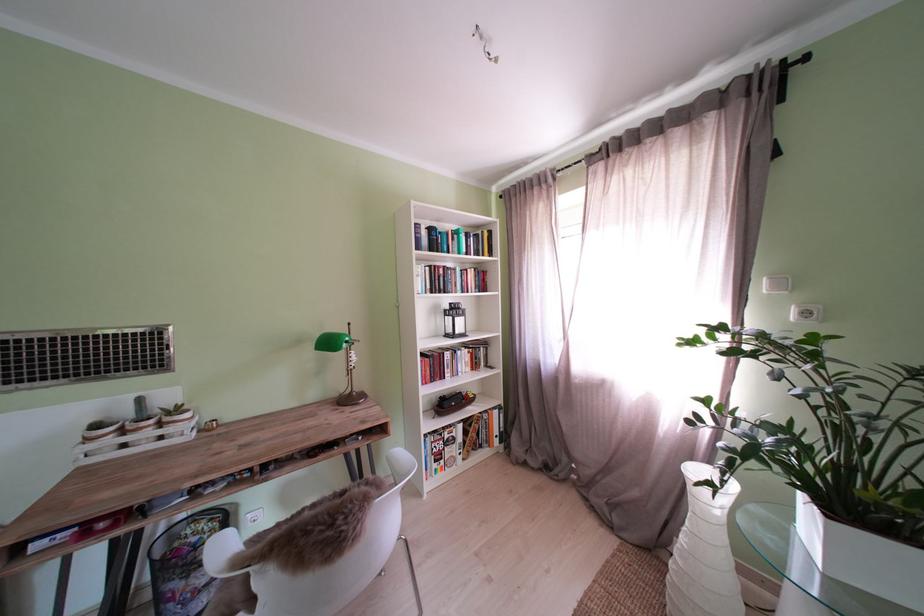
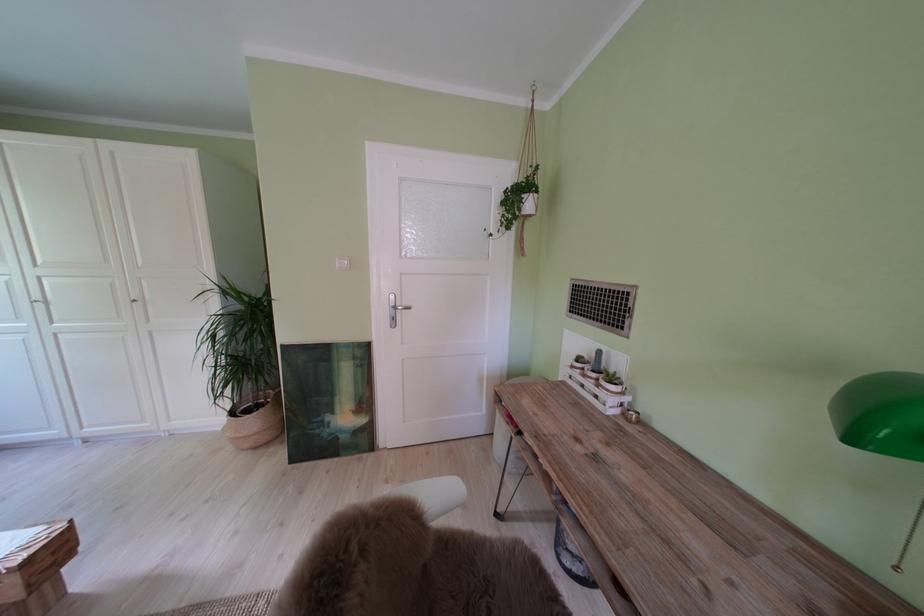
Where in the second image is the point corresponding to point 163,427 from the first image?

(604, 381)